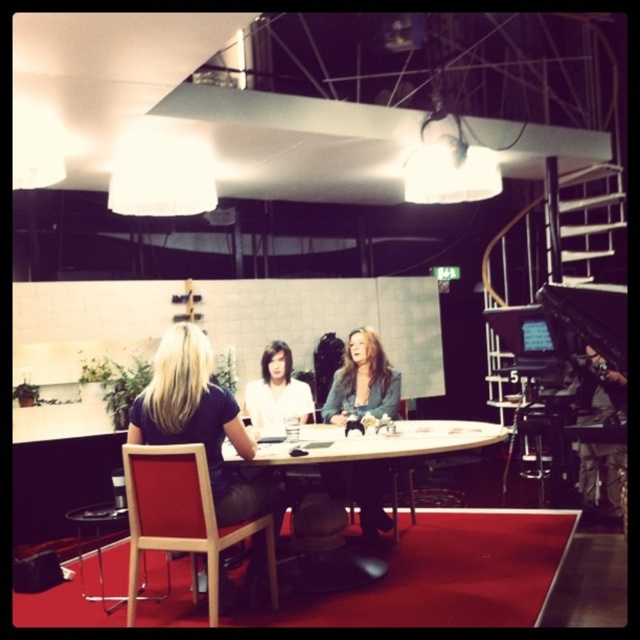
Which is more to the left, wooden round table at center or matte gray blazer at center?

Positioned to the left is matte gray blazer at center.

Is point (403, 433) positioned behind point (378, 340)?

No.

You are a GUI agent. You are given a task and a screenshot of the screen. Output one action in this format:
    pyautogui.click(x=<x>, y=<y>)
    Task: Click on the wooden round table at center
    The image size is (640, 640).
    Given the screenshot: What is the action you would take?
    pyautogui.click(x=381, y=442)

You are a GUI agent. You are given a task and a screenshot of the screen. Output one action in this format:
    pyautogui.click(x=<x>, y=<y>)
    Task: Click on the wooden chair at lower left
    
    Given the screenshot: What is the action you would take?
    pyautogui.click(x=180, y=518)

Can you confirm if wooden chair at lower left is taller than matte white shirt at center?

Yes, wooden chair at lower left is taller than matte white shirt at center.

At what (x,y) coordinates should I click in order to perform the action: click on wooden chair at lower left. Please return your answer as a coordinate pair (x, y). This screenshot has height=640, width=640. Looking at the image, I should click on (180, 518).

Between wooden chair at lower left and matte gray blazer at center, which one is positioned higher?

matte gray blazer at center

In the scene shown: Does wooden chair at lower left have a greater width compared to matte gray blazer at center?

Yes, wooden chair at lower left is wider than matte gray blazer at center.

What are the coordinates of `wooden chair at lower left` in the screenshot? It's located at (180, 518).